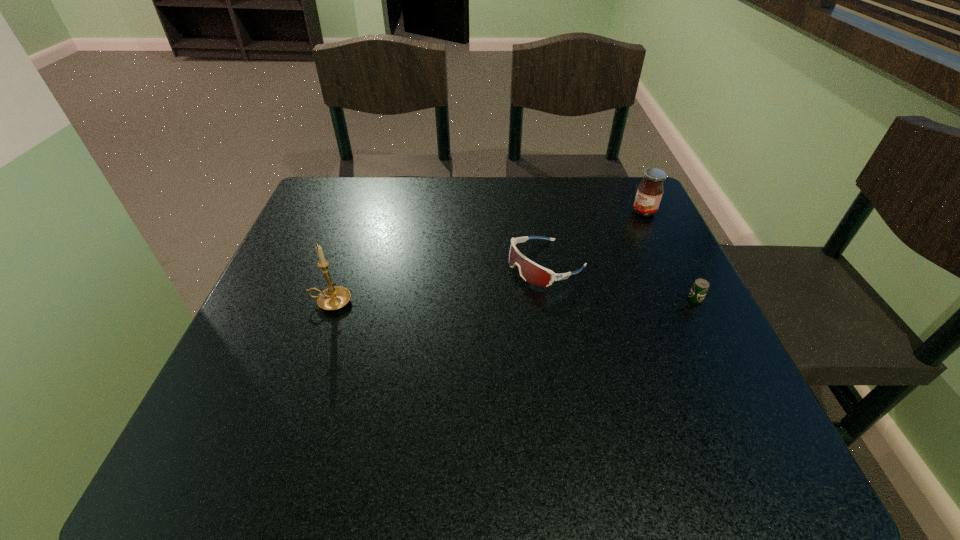
At what (x,y) coordinates should I click in order to perform the action: click on free point that satisfies the following two spatial constraints: 1. on the front side of the beer can; 2. on the right side of the third tallest object. Please return your answer as a coordinate pair (x, y). This screenshot has height=540, width=960. Looking at the image, I should click on (553, 299).